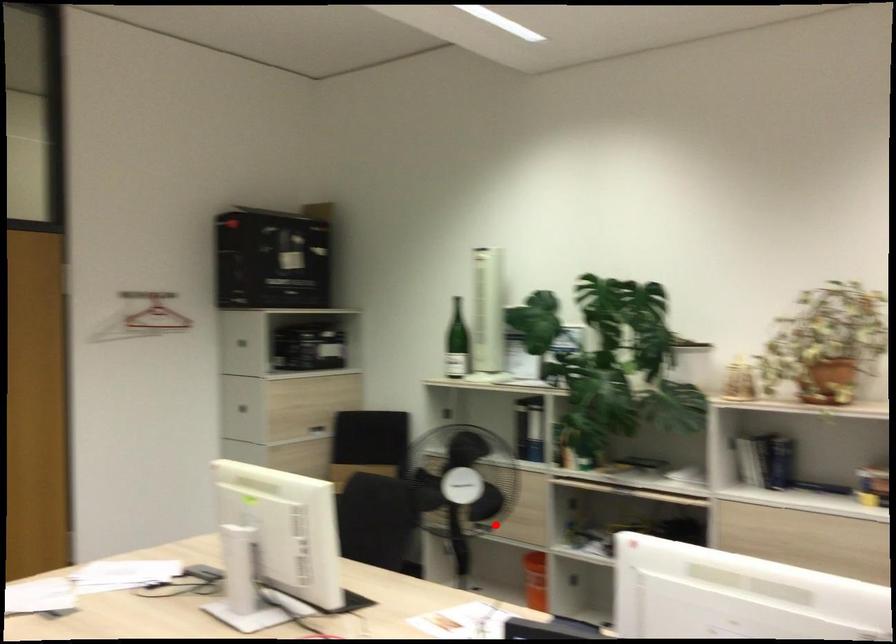
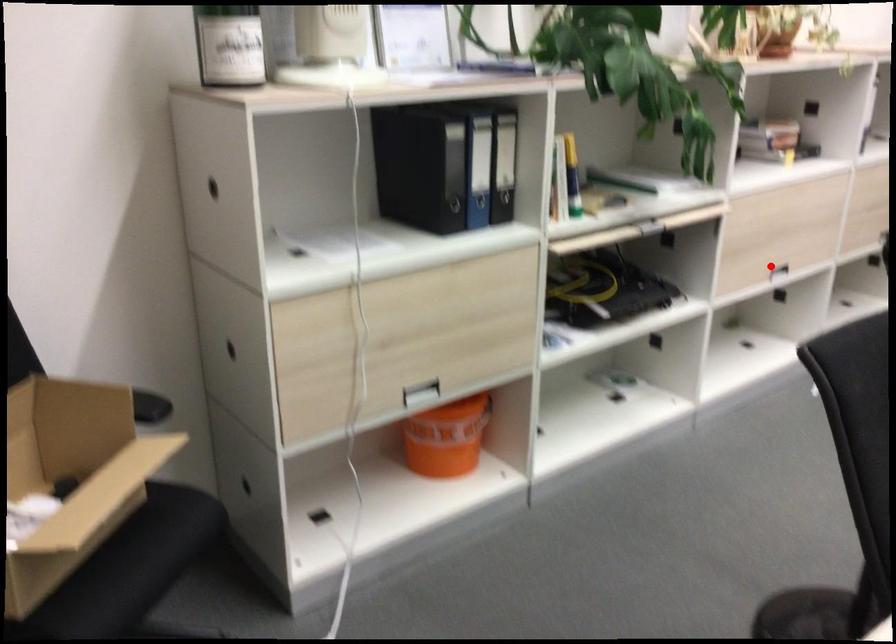
I am providing you with two images of the same scene from different viewpoints. A red point is marked on the first image and another point is marked on the second image. Are the points marked in image1 and image2 representing the same 3D position?

No